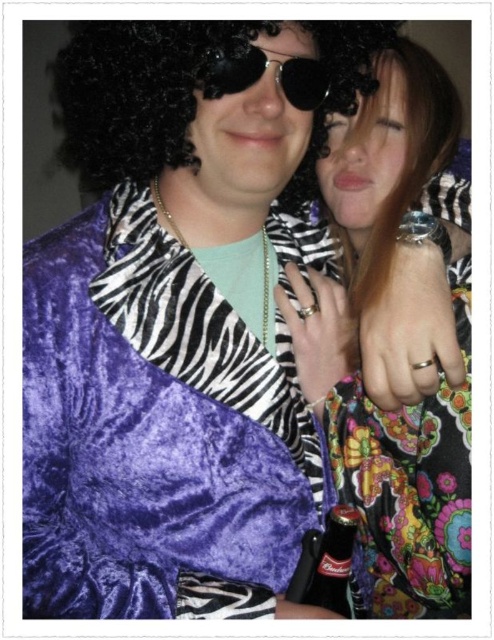
Question: Is purple velvet robe at left bigger than black reflective sunglasses at center?

Choices:
 (A) no
 (B) yes

Answer: (B)

Question: Which object appears farthest from the camera in this image?

Choices:
 (A) black glass bottle at center
 (B) black reflective sunglasses at center
 (C) floral-patterned fabric at upper right
 (D) purple velvet robe at left

Answer: (A)

Question: Based on their relative distances, which object is farther from the floral-patterned fabric at upper right?

Choices:
 (A) black glass bottle at center
 (B) black reflective sunglasses at center
 (C) purple velvet robe at left

Answer: (B)

Question: From the image, what is the correct spatial relationship of purple velvet robe at left in relation to black reflective sunglasses at center?

Choices:
 (A) left
 (B) right

Answer: (A)

Question: Estimate the real-world distances between objects in this image. Which object is closer to the purple velvet robe at left?

Choices:
 (A) black glass bottle at center
 (B) floral-patterned fabric at upper right
 (C) black reflective sunglasses at center

Answer: (B)

Question: Can you confirm if floral-patterned fabric at upper right is positioned below black glass bottle at center?

Choices:
 (A) yes
 (B) no

Answer: (B)